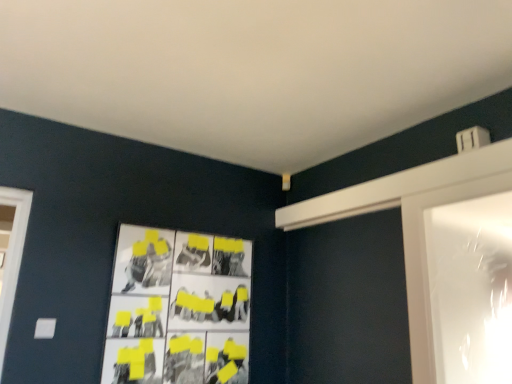
Locate an element on the screen. This screenshot has width=512, height=384. metallic silver frame at upper left is located at coordinates (178, 309).

This screenshot has width=512, height=384. What do you see at coordinates (178, 309) in the screenshot?
I see `metallic silver frame at upper left` at bounding box center [178, 309].

At what (x,y) coordinates should I click in order to perform the action: click on metallic silver frame at upper left. Please return your answer as a coordinate pair (x, y). The height and width of the screenshot is (384, 512). Looking at the image, I should click on (178, 309).